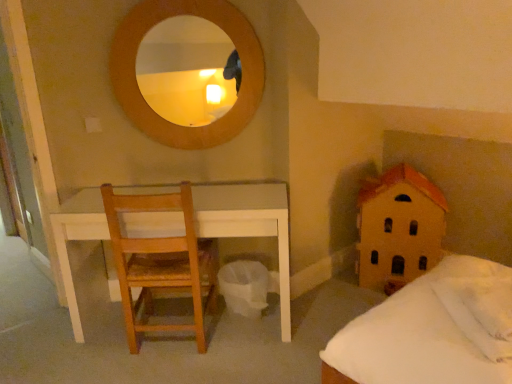
Question: Is white soft pillow at lower right, which ranks as the second pillow in back-to-front order, shorter than light brown wooden chair at left?

Choices:
 (A) no
 (B) yes

Answer: (B)

Question: Could you tell me if white soft pillow at lower right, which is counted as the 1th pillow, starting from the front, is facing light brown wooden chair at left?

Choices:
 (A) yes
 (B) no

Answer: (A)

Question: Considering the relative sizes of white soft pillow at lower right, which is counted as the 1th pillow, starting from the front, and light brown wooden chair at left in the image provided, is white soft pillow at lower right, which is counted as the 1th pillow, starting from the front, wider than light brown wooden chair at left?

Choices:
 (A) no
 (B) yes

Answer: (A)

Question: From the image's perspective, is white soft pillow at lower right, which ranks as the second pillow in back-to-front order, beneath light brown wooden chair at left?

Choices:
 (A) no
 (B) yes

Answer: (B)

Question: From the image's perspective, is white fluffy pillow at lower right, which is the first pillow in back-to-front order, above or below light brown wooden chair at left?

Choices:
 (A) above
 (B) below

Answer: (B)

Question: Is white fluffy pillow at lower right, which ranks as the 2th pillow in front-to-back order, in front of or behind light brown wooden chair at left in the image?

Choices:
 (A) front
 (B) behind

Answer: (A)

Question: Is white fluffy pillow at lower right, which ranks as the 2th pillow in front-to-back order, wider or thinner than light brown wooden chair at left?

Choices:
 (A) thin
 (B) wide

Answer: (A)

Question: From a real-world perspective, is white fluffy pillow at lower right, which ranks as the 2th pillow in front-to-back order, physically located above or below light brown wooden chair at left?

Choices:
 (A) above
 (B) below

Answer: (A)

Question: From the image's perspective, is white soft pillow at lower right, which ranks as the second pillow in back-to-front order, positioned above or below light brown wooden chair at left?

Choices:
 (A) below
 (B) above

Answer: (A)

Question: In terms of height, does white soft pillow at lower right, which is counted as the 1th pillow, starting from the front, look taller or shorter compared to light brown wooden chair at left?

Choices:
 (A) short
 (B) tall

Answer: (A)

Question: From a real-world perspective, relative to light brown wooden chair at left, is white soft pillow at lower right, which is counted as the 1th pillow, starting from the front, vertically above or below?

Choices:
 (A) below
 (B) above

Answer: (B)

Question: Visually, is white soft pillow at lower right, which is counted as the 1th pillow, starting from the front, positioned to the left or to the right of light brown wooden chair at left?

Choices:
 (A) left
 (B) right

Answer: (B)

Question: In terms of width, does light brown wooden chair at left look wider or thinner when compared to white soft pillow at lower right, which ranks as the second pillow in back-to-front order?

Choices:
 (A) thin
 (B) wide

Answer: (B)

Question: Considering the positions of light brown wooden chair at left and white soft pillow at lower right, which is counted as the 1th pillow, starting from the front, in the image, is light brown wooden chair at left taller or shorter than white soft pillow at lower right, which is counted as the 1th pillow, starting from the front,?

Choices:
 (A) short
 (B) tall

Answer: (B)